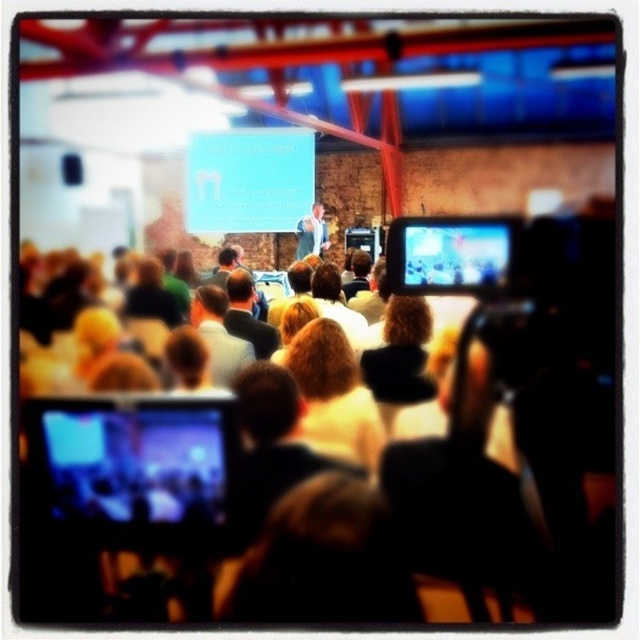
Is matte black laptop at upper center thinner than blonde hair at center?

Incorrect, matte black laptop at upper center's width is not less than blonde hair at center's.

Which is more to the right, matte black laptop at upper center or blonde hair at center?

From the viewer's perspective, blonde hair at center appears more on the right side.

The image size is (640, 640). Find the location of `matte black laptop at upper center`. matte black laptop at upper center is located at coordinates [138, 464].

Can you confirm if blue glossy projector screen at upper center is taller than light brown leather jacket at center?

Correct, blue glossy projector screen at upper center is much taller as light brown leather jacket at center.

Does blue glossy projector screen at upper center appear on the right side of light brown leather jacket at center?

In fact, blue glossy projector screen at upper center is to the left of light brown leather jacket at center.

Does point (275, 212) lie in front of point (316, 234)?

Yes, it is.

At what (x,y) coordinates should I click in order to perform the action: click on blue glossy projector screen at upper center. Please return your answer as a coordinate pair (x, y). Looking at the image, I should click on (248, 179).

Consider the image. Does matte black laptop at upper center appear over dark gray suit at center?

No, matte black laptop at upper center is not above dark gray suit at center.

Between matte black laptop at upper center and dark gray suit at center, which one has more height?

matte black laptop at upper center is taller.

Consider the image. Who is more distant from viewer, (92, 440) or (227, 312)?

Positioned behind is point (227, 312).

The height and width of the screenshot is (640, 640). What are the coordinates of `matte black laptop at upper center` in the screenshot? It's located at (138, 464).